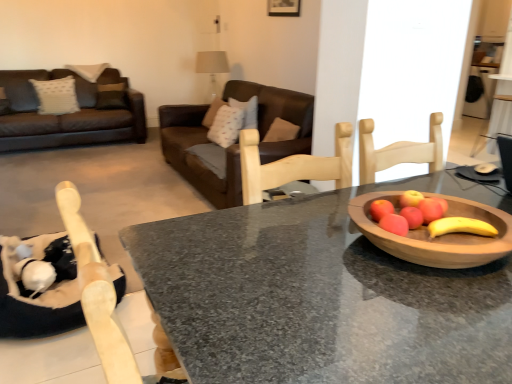
The image size is (512, 384). What are the coordinates of `free space in front of red matte apple at center` in the screenshot? It's located at (430, 278).